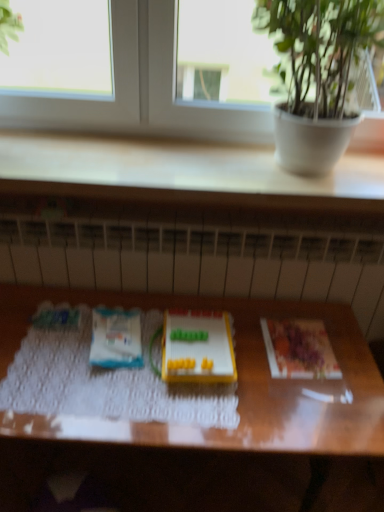
The height and width of the screenshot is (512, 384). Describe the element at coordinates (299, 349) in the screenshot. I see `printed paper at right, which appears as the first paperback book when viewed from the right` at that location.

What is the approximate height of transparent glass window at upper center?

It is 38.28 centimeters.

I want to click on wooden table at center, so click(x=212, y=428).

Locate an element on the screen. This screenshot has height=512, width=384. white textured radiator at center is located at coordinates (197, 260).

Would you consider printed paper at right, which appears as the first paperback book when viewed from the right, to be distant from wooden table at center?

printed paper at right, which appears as the first paperback book when viewed from the right, is actually quite close to wooden table at center.

Between printed paper at right, which appears as the first paperback book when viewed from the right, and wooden table at center, which one is positioned behind?

printed paper at right, which appears as the first paperback book when viewed from the right, is behind.

Could you tell me if printed paper at right, the 2th paperback book viewed from the left, is turned towards wooden table at center?

Yes, printed paper at right, the 2th paperback book viewed from the left, is turned towards wooden table at center.

From the image's perspective, who appears lower, printed paper at right, which appears as the first paperback book when viewed from the right, or wooden table at center?

wooden table at center appears lower in the image.

How much distance is there between wooden table at center and white textured radiator at center?

The distance of wooden table at center from white textured radiator at center is 17.18 centimeters.

Which point is more distant from viewer, (325, 428) or (71, 244)?

The point (71, 244) is farther.

In the scene shown: What's the angular difference between wooden table at center and white textured radiator at center's facing directions?

The angle between the facing direction of wooden table at center and the facing direction of white textured radiator at center is 0.813 degrees.

Is wooden table at center in contact with white textured radiator at center?

No, wooden table at center is not making contact with white textured radiator at center.

From a real-world perspective, between printed paper at right, the 2th paperback book viewed from the left, and white textured radiator at center, who is vertically lower?

white textured radiator at center is physically lower.

Which object is positioned more to the left, printed paper at right, the 2th paperback book viewed from the left, or white textured radiator at center?

white textured radiator at center is more to the left.

How much distance is there between printed paper at right, which appears as the first paperback book when viewed from the right, and white textured radiator at center?

They are 30.46 centimeters apart.

Is printed paper at right, the 2th paperback book viewed from the left, wider or thinner than white textured radiator at center?

Considering their sizes, printed paper at right, the 2th paperback book viewed from the left, looks broader than white textured radiator at center.

Could you tell me if white matte paper at center, which is the 2th paperback book from right to left, is facing wooden table at center?

No, white matte paper at center, which is the 2th paperback book from right to left, does not turn towards wooden table at center.

Which object is wider, white matte paper at center, the 1th paperback book when ordered from left to right, or wooden table at center?

wooden table at center.

From a real-world perspective, is white matte paper at center, the 1th paperback book when ordered from left to right, on wooden table at center?

Yes, from a real-world perspective, white matte paper at center, the 1th paperback book when ordered from left to right, is above wooden table at center.

Is white matte paper at center, the 1th paperback book when ordered from left to right, in front of or behind wooden table at center in the image?

Clearly, white matte paper at center, the 1th paperback book when ordered from left to right, is behind wooden table at center.

Is yellow plastic toy at center not close to transparent glass window at upper center?

No, yellow plastic toy at center is not far away from transparent glass window at upper center.

Looking at this image, is yellow plastic toy at center to the right of transparent glass window at upper center from the viewer's perspective?

Indeed, yellow plastic toy at center is positioned on the right side of transparent glass window at upper center.

Where is `window on the left of yellow plastic toy at center`? The height and width of the screenshot is (512, 384). window on the left of yellow plastic toy at center is located at coordinates (140, 89).

Considering the sizes of objects yellow plastic toy at center and transparent glass window at upper center in the image provided, who is bigger, yellow plastic toy at center or transparent glass window at upper center?

With larger size is transparent glass window at upper center.

From the picture: Which is closer to the camera, (273,261) or (83,459)?

Clearly, point (273,261) is closer to the camera than point (83,459).

Measure the distance between white textured radiator at center and wooden table at center.

white textured radiator at center is 17.18 centimeters away from wooden table at center.

From the image's perspective, who appears lower, white textured radiator at center or wooden table at center?

wooden table at center.

Between white textured radiator at center and wooden table at center, which one has larger width?

wooden table at center.

Identify the location of paperback book located above the printed paper at right, the 2th paperback book viewed from the left (from the image's perspective). (116, 338).

Is white matte paper at center, which is the 2th paperback book from right to left, smaller than printed paper at right, the 2th paperback book viewed from the left?

Incorrect, white matte paper at center, which is the 2th paperback book from right to left, is not smaller in size than printed paper at right, the 2th paperback book viewed from the left.

Is white matte paper at center, which is the 2th paperback book from right to left, in front of or behind printed paper at right, the 2th paperback book viewed from the left, in the image?

Clearly, white matte paper at center, which is the 2th paperback book from right to left, is in front of printed paper at right, the 2th paperback book viewed from the left.

Which of these two, white matte paper at center, the 1th paperback book when ordered from left to right, or printed paper at right, which appears as the first paperback book when viewed from the right, is thinner?

printed paper at right, which appears as the first paperback book when viewed from the right, is thinner.

Where is `the 1st paperback book positioned above the wooden table at center (from a real-world perspective)`? the 1st paperback book positioned above the wooden table at center (from a real-world perspective) is located at coordinates (299, 349).

Where is `table below the white textured radiator at center (from the image's perspective)`? The height and width of the screenshot is (512, 384). table below the white textured radiator at center (from the image's perspective) is located at coordinates (212, 428).

Considering their positions, is transparent glass window at upper center positioned further to green leafy plant at upper right than white textured radiator at center?

Based on the image, white textured radiator at center appears to be further to green leafy plant at upper right.

Based on their spatial positions, is transparent glass window at upper center or yellow plastic toy at center closer to wooden table at center?

yellow plastic toy at center is closer to wooden table at center.

Based on their spatial positions, is printed paper at right, which appears as the first paperback book when viewed from the right, or wooden table at center closer to white textured radiator at center?

Based on the image, wooden table at center appears to be nearer to white textured radiator at center.

Estimate the real-world distances between objects in this image. Which object is closer to white textured radiator at center, wooden table at center or printed paper at right, which appears as the first paperback book when viewed from the right?

wooden table at center lies closer to white textured radiator at center than the other object.

From the picture: Estimate the real-world distances between objects in this image. Which object is further from printed paper at right, which appears as the first paperback book when viewed from the right, green leafy plant at upper right or white textured radiator at center?

green leafy plant at upper right is further to printed paper at right, which appears as the first paperback book when viewed from the right.

Estimate the real-world distances between objects in this image. Which object is closer to wooden table at center, white textured radiator at center or transparent glass window at upper center?

white textured radiator at center is positioned closer to the anchor wooden table at center.

Based on their spatial positions, is wooden table at center or white matte paper at center, the 1th paperback book when ordered from left to right, closer to yellow plastic toy at center?

white matte paper at center, the 1th paperback book when ordered from left to right.

Based on their spatial positions, is green leafy plant at upper right or yellow plastic toy at center closer to printed paper at right, which appears as the first paperback book when viewed from the right?

yellow plastic toy at center is closer to printed paper at right, which appears as the first paperback book when viewed from the right.

Where is `radiator between transparent glass window at upper center and white matte paper at center, which is the 2th paperback book from right to left, in the vertical direction`? radiator between transparent glass window at upper center and white matte paper at center, which is the 2th paperback book from right to left, in the vertical direction is located at coordinates (197, 260).

I want to click on toy that lies between white matte paper at center, which is the 2th paperback book from right to left, and wooden table at center from top to bottom, so click(197, 348).

Locate an element on the screen. radiator that lies between green leafy plant at upper right and printed paper at right, which appears as the first paperback book when viewed from the right, from top to bottom is located at coordinates (197, 260).

Identify the location of paperback book that lies between transparent glass window at upper center and yellow plastic toy at center from top to bottom. This screenshot has width=384, height=512. (116, 338).